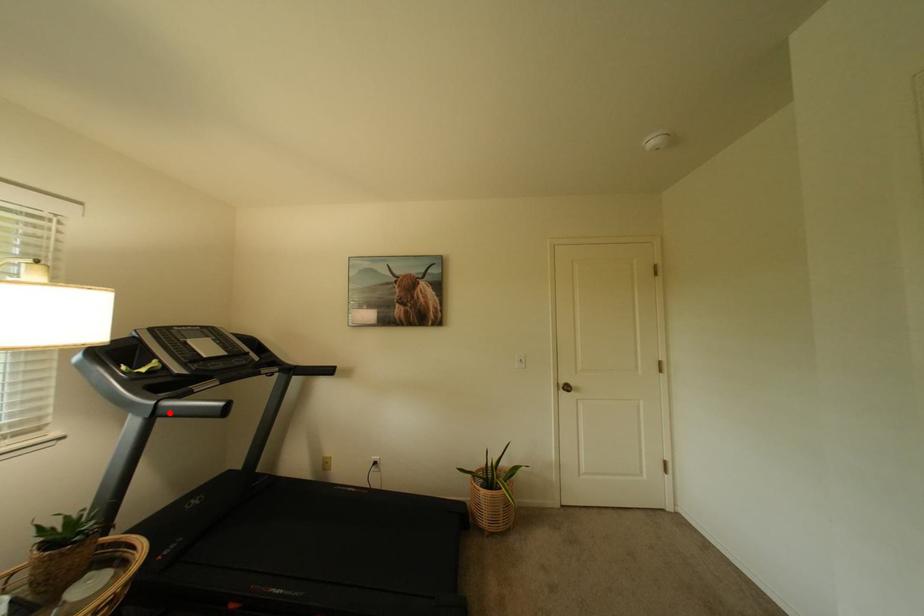
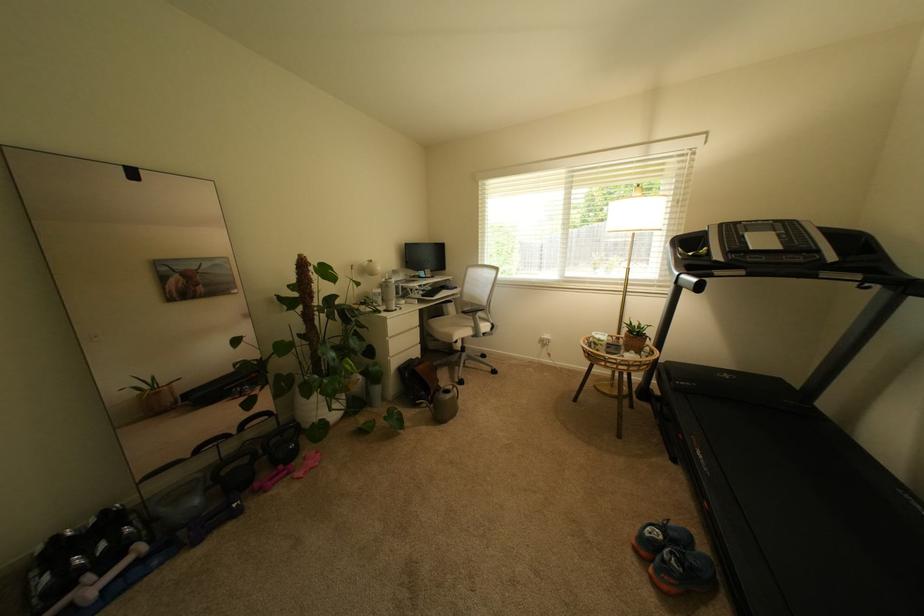
The point at the highlighted location is marked in the first image. Where is the corresponding point in the second image?

(688, 283)